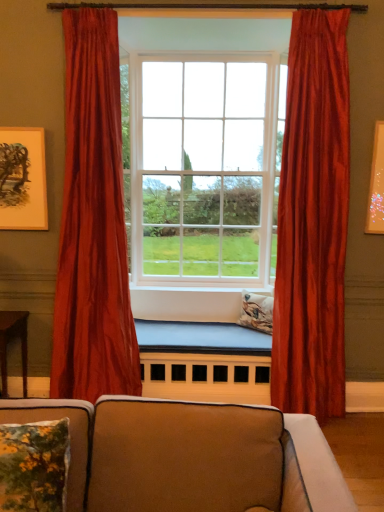
At what (x,y) coordinates should I click in order to perform the action: click on vacant space that is to the left of floral fabric pillow at center, which is the second pillow from front to back. Please return your answer as a coordinate pair (x, y). Looking at the image, I should click on (223, 329).